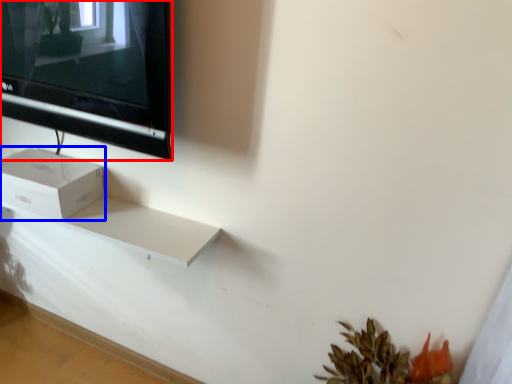
Question: Which point is closer to the camera, television (highlighted by a red box) or box (highlighted by a blue box)?

Choices:
 (A) television
 (B) box

Answer: (A)